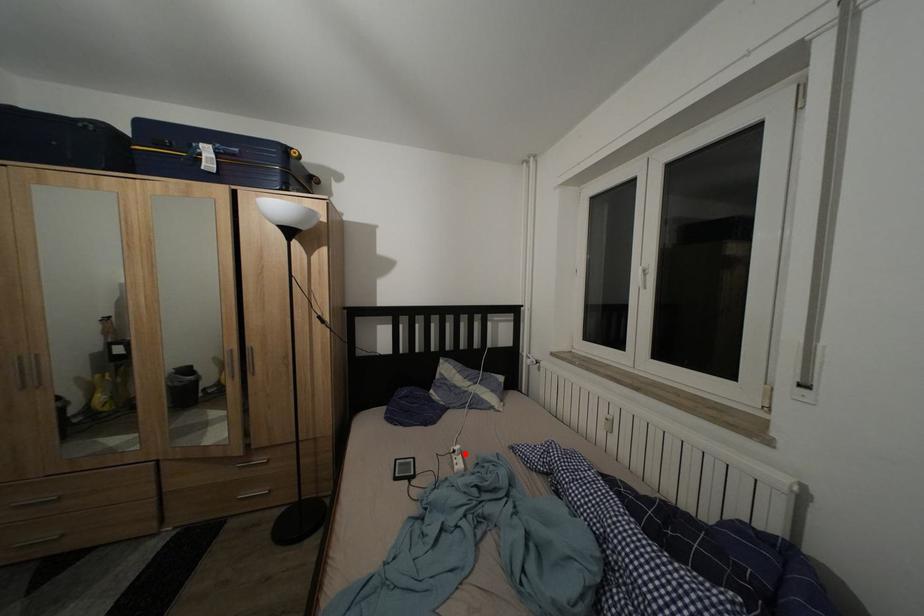
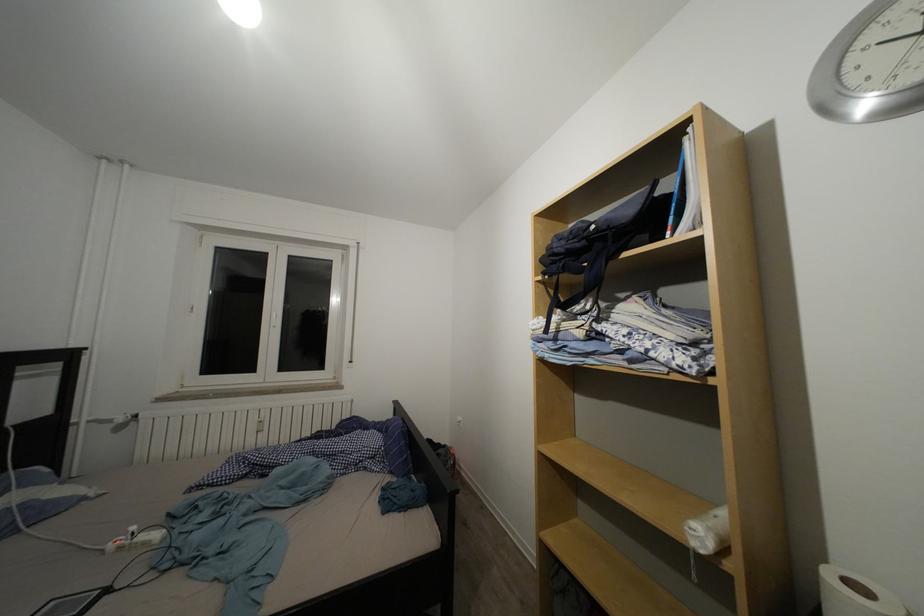
Question: I am providing you with two images of the same scene from different viewpoints. Given a red point in image1, look at the same physical point in image2. Is it:

Choices:
 (A) Closer to the viewpoint
 (B) Farther from the viewpoint

Answer: (A)